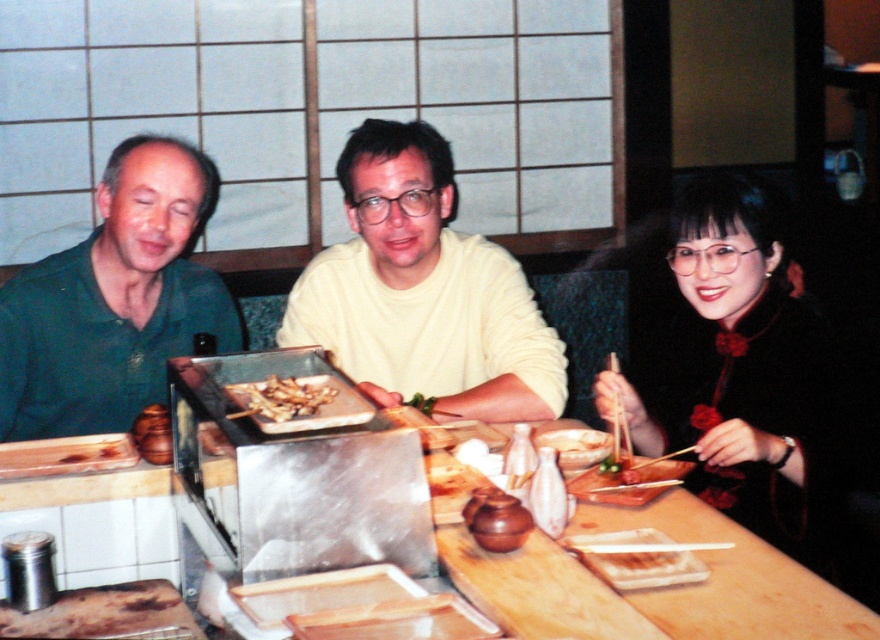
Does yellow matte sweater at center appear on the right side of black velvet dress at right?

Incorrect, yellow matte sweater at center is not on the right side of black velvet dress at right.

Is yellow matte sweater at center bigger than black velvet dress at right?

Indeed, yellow matte sweater at center has a larger size compared to black velvet dress at right.

Which is behind, point (442, 416) or point (739, 474)?

The point (442, 416) is behind.

This screenshot has width=880, height=640. Find the location of `yellow matte sweater at center`. yellow matte sweater at center is located at coordinates (423, 291).

Based on the photo, does black velvet dress at right have a lesser height compared to brown glossy meat at center?

No, black velvet dress at right is not shorter than brown glossy meat at center.

Which is in front, point (676, 340) or point (275, 380)?

Point (275, 380) is more forward.

Which is in front, point (759, 520) or point (248, 410)?

Positioned in front is point (248, 410).

You are a GUI agent. You are given a task and a screenshot of the screen. Output one action in this format:
    pyautogui.click(x=<x>, y=<y>)
    Task: Click on the black velvet dress at right
    This screenshot has height=640, width=880.
    Given the screenshot: What is the action you would take?
    pyautogui.click(x=743, y=372)

Can you confirm if yellow matte sweater at center is smaller than green matte shirt at left?

No.

Can you confirm if yellow matte sweater at center is thinner than green matte shirt at left?

Incorrect, yellow matte sweater at center's width is not less than green matte shirt at left's.

Is point (528, 312) positioned in front of point (221, 348)?

Yes, point (528, 312) is in front of point (221, 348).

This screenshot has height=640, width=880. Find the location of `yellow matte sweater at center`. yellow matte sweater at center is located at coordinates (423, 291).